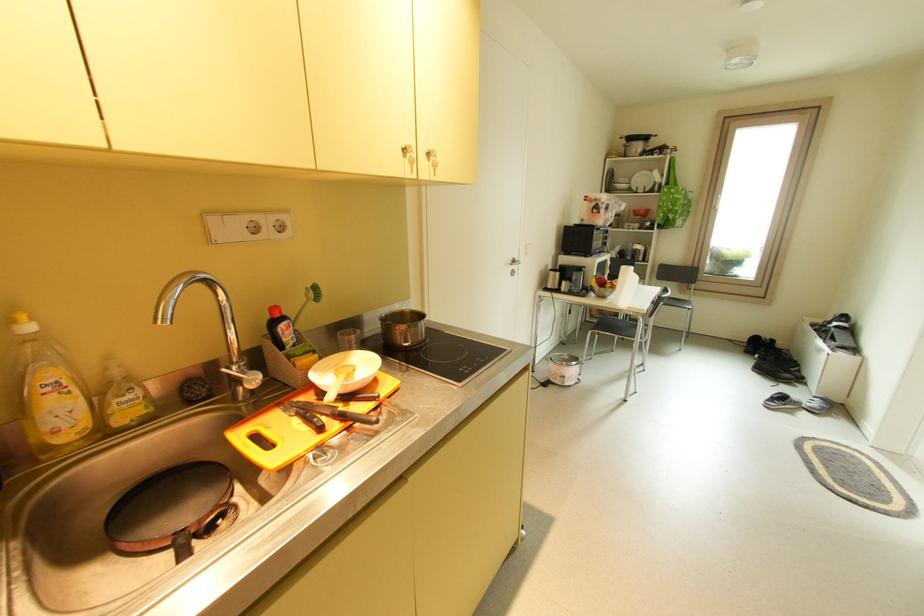
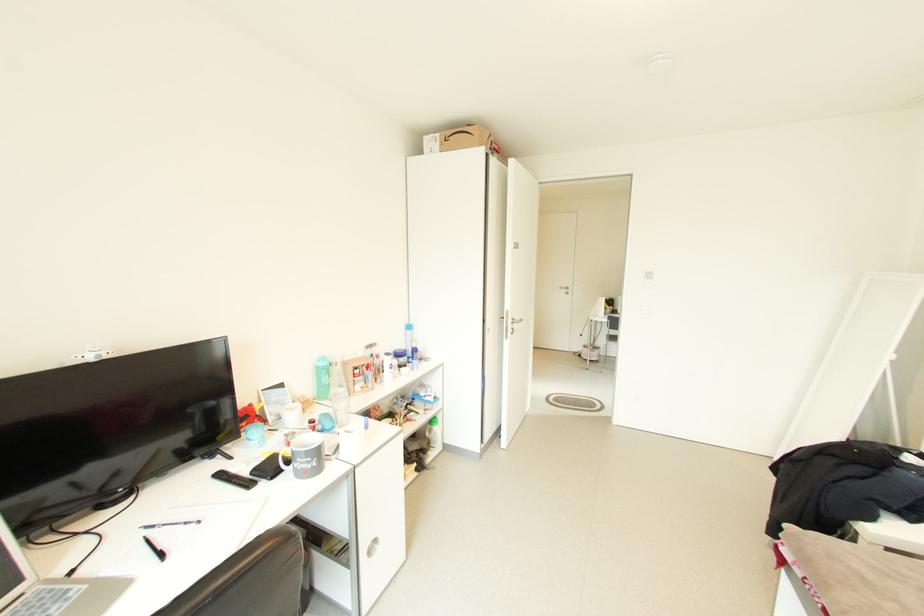
Question: I am providing you with two images of the same scene from different viewpoints. Please identify which objects are invisible in image2.

Choices:
 (A) green water bottle
 (B) knife handle
 (C) round cabinet handle
 (D) rolled green material

Answer: (B)